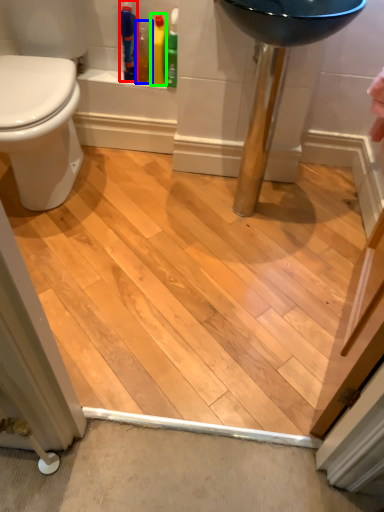
Question: Considering the real-world distances, which object is closest to toiletry (highlighted by a red box)? cleaning product (highlighted by a blue box) or cleaning product (highlighted by a green box).

Choices:
 (A) cleaning product
 (B) cleaning product

Answer: (A)